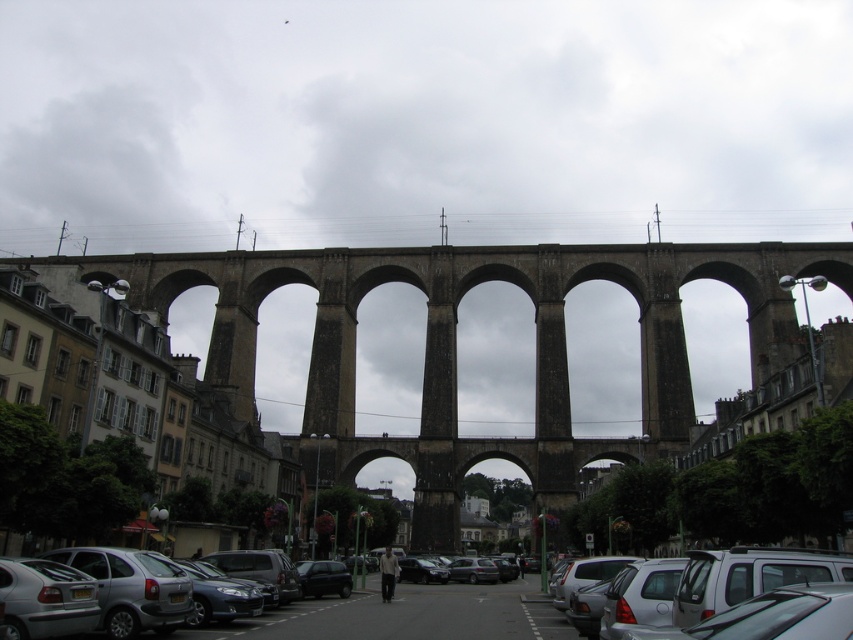
From the picture: You are standing at the base of the viaduct and want to reach the two points marked in the image. Which point, point (676, 595) or point (71, 577), is closer to you?

Point (676, 595) is closer to the viewer than point (71, 577).